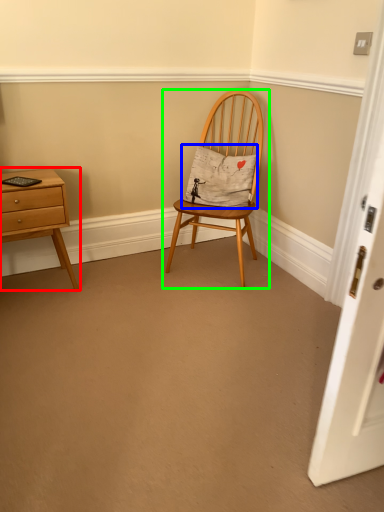
Question: Which is farther away from nightstand (highlighted by a red box)? pillow (highlighted by a blue box) or chair (highlighted by a green box)?

Choices:
 (A) pillow
 (B) chair

Answer: (A)